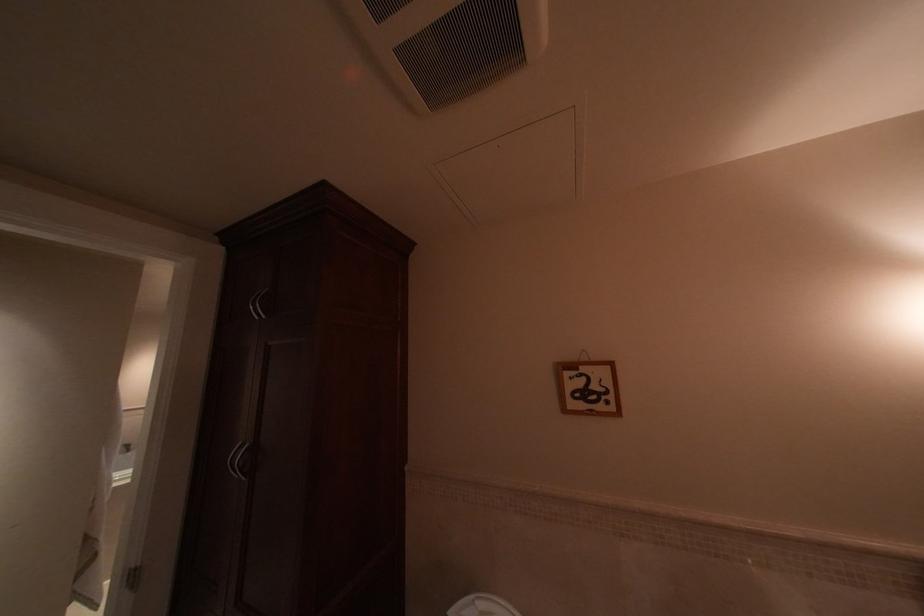
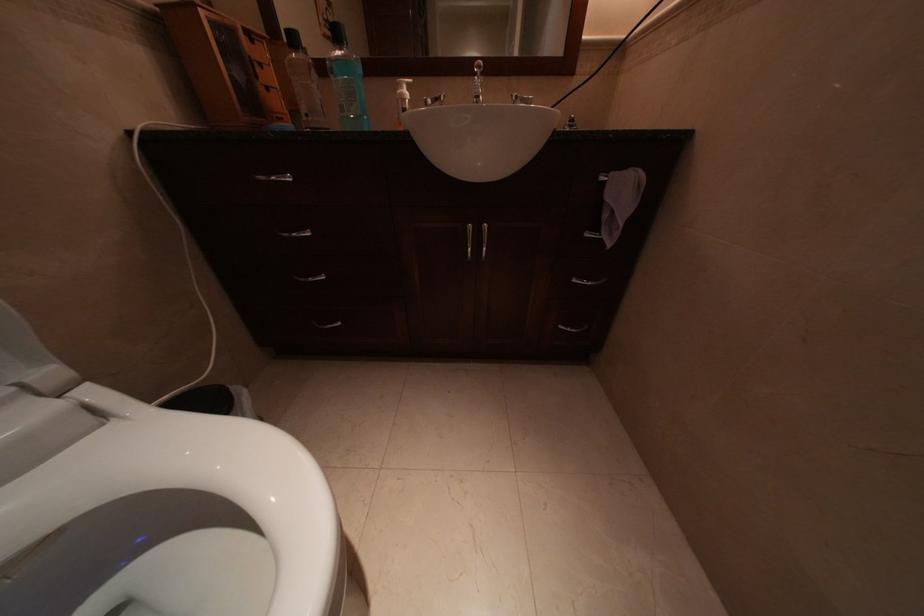
The images are taken continuously from a first-person perspective. In which direction is your viewpoint rotating?

The rotation direction of the camera is right-down.